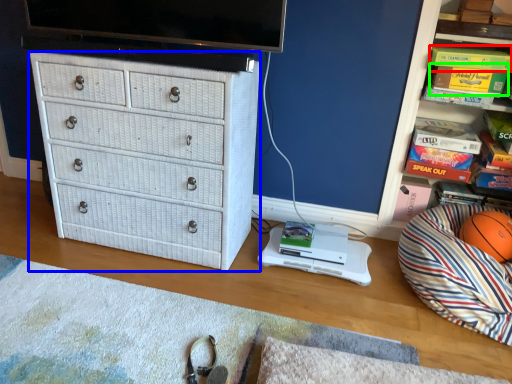
Question: Considering the real-world distances, which object is farthest from book (highlighted by a red box)? chest of drawers (highlighted by a blue box) or magazine (highlighted by a green box)?

Choices:
 (A) chest of drawers
 (B) magazine

Answer: (A)